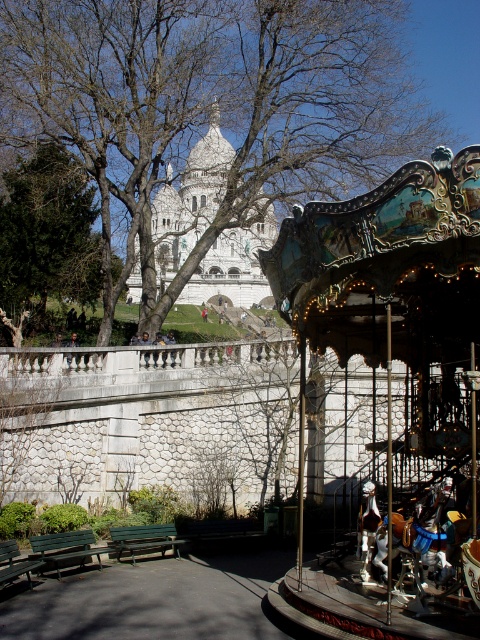
You are planning to place a new bench in the park. The shiny teal carousel at right is wider than the green painted wood bench at lower left. Which object should you avoid placing a bench near if you want to ensure there is enough space?

You should avoid placing a bench near the shiny teal carousel at right because it is wider than the green painted wood bench at lower left, meaning less space is available around it.

You are standing at the center of the park, and you want to locate the shiny teal carousel at right. Based on the coordinates provided, which direction should you face to see it?

The shiny teal carousel at right is located at coordinates point (x=399, y=358), so you should face towards the right side of the park to see it.

You are a visitor at the park and want to sit on the green wooden bench at lower left. From your current position at the shiny teal carousel at right, in which direction should you walk to reach the bench?

The shiny teal carousel at right is above the green wooden bench at lower left, so you should walk downward to reach the bench.